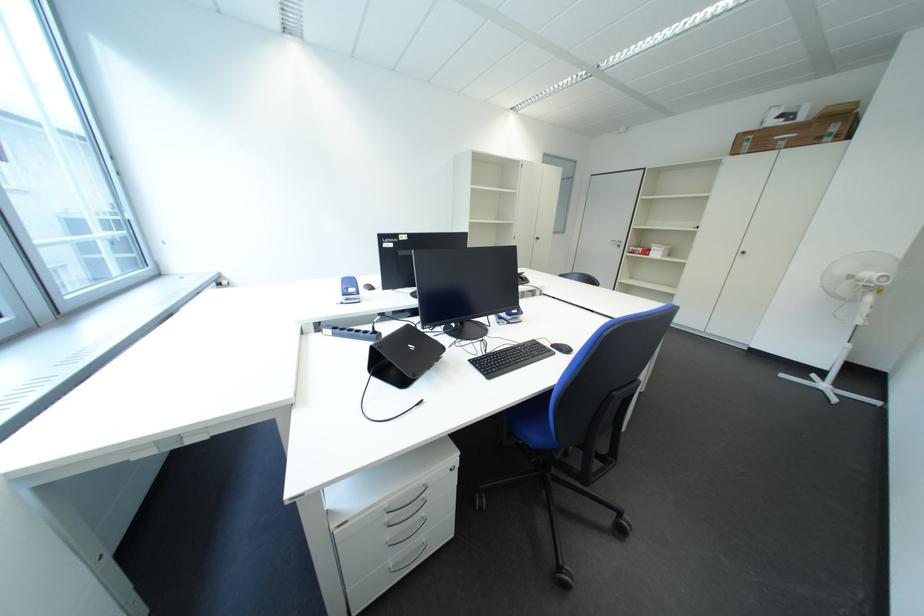
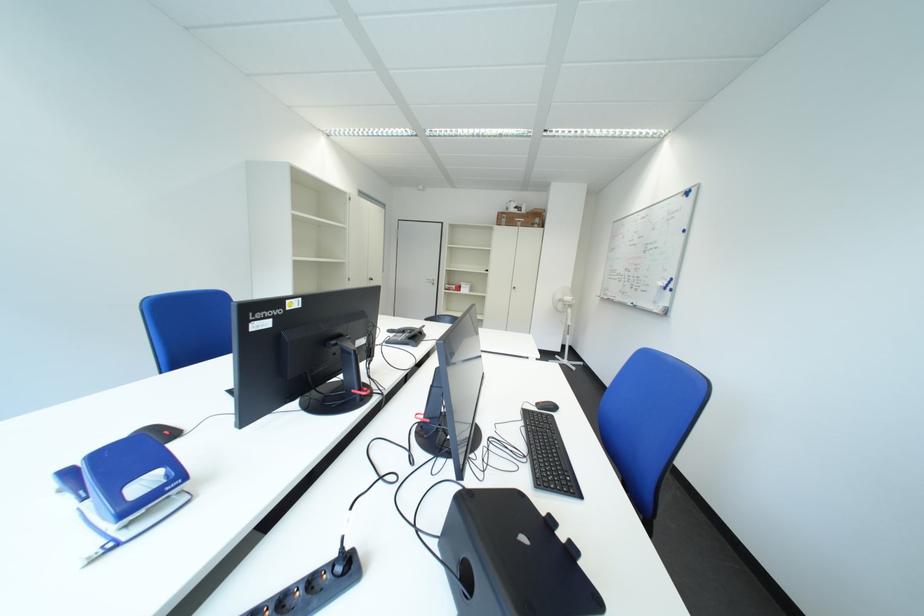
In the second image, find the point that corresponds to [487,363] in the first image.

(553, 485)